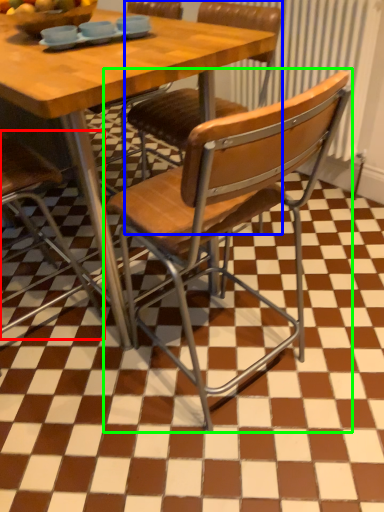
Question: Based on their relative distances, which object is farther from chair (highlighted by a red box)? Choose from chair (highlighted by a blue box) and chair (highlighted by a green box).

Choices:
 (A) chair
 (B) chair

Answer: (A)